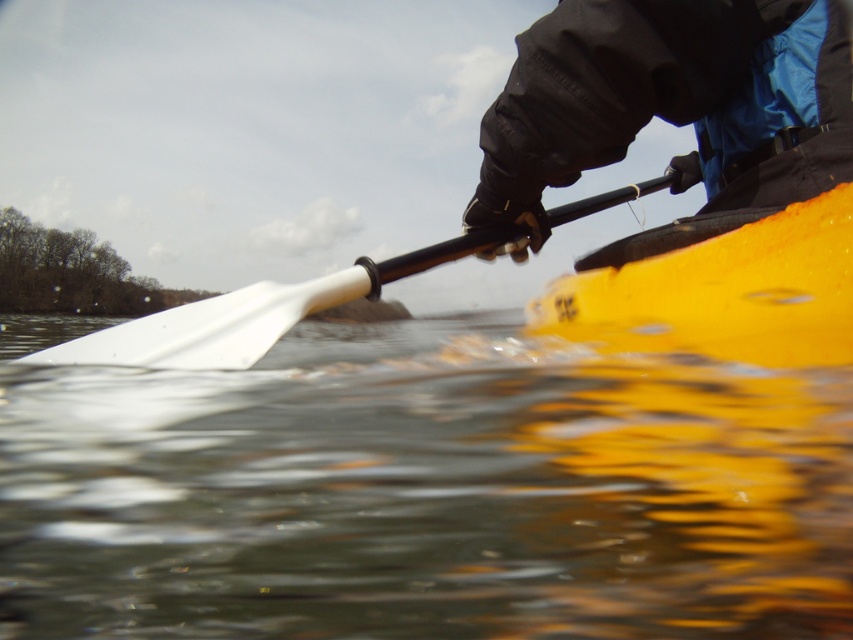
In the scene shown: You are a photographer trying to capture the kayak and paddle in the image. Since the yellow matte kayak at center and the white plastic paddle at center are both at the center, which one appears shorter in the photo?

The yellow matte kayak at center has a lesser height compared to the white plastic paddle at center, so the kayak appears shorter in the photo.

You are planning to place a floating marker on the water between the transparent water at lower center and the yellow matte kayak at center. Based on their widths, which one should the marker be placed closer to?

The transparent water at lower center is wider than the yellow matte kayak at center, so the marker should be placed closer to the yellow matte kayak at center to balance the width difference.